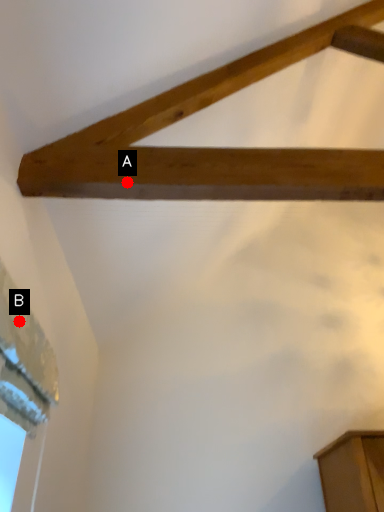
Question: Two points are circled on the image, labeled by A and B beside each circle. Which point is farther to the camera?

Choices:
 (A) A is further
 (B) B is further

Answer: (A)